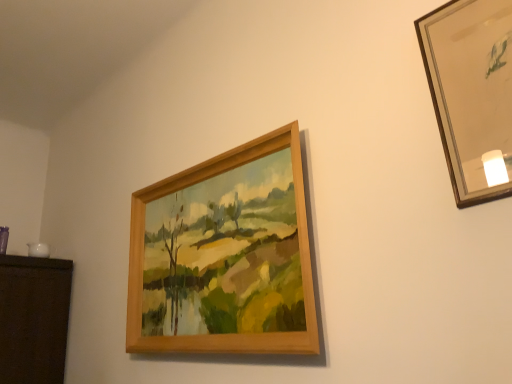
Question: From the image's perspective, is wooden picture frame at upper right, which ranks as the 2th picture frame in left-to-right order, beneath wooden frame at upper center, which is the first picture frame in back-to-front order?

Choices:
 (A) yes
 (B) no

Answer: (B)

Question: Is wooden picture frame at upper right, positioned as the 1th picture frame in front-to-back order, touching wooden frame at upper center, the first picture frame positioned from the left?

Choices:
 (A) yes
 (B) no

Answer: (B)

Question: Can you confirm if wooden picture frame at upper right, which appears as the first picture frame when viewed from the right, is positioned to the right of wooden frame at upper center, the first picture frame positioned from the left?

Choices:
 (A) no
 (B) yes

Answer: (B)

Question: Does wooden picture frame at upper right, which appears as the first picture frame when viewed from the right, have a lesser width compared to wooden frame at upper center, the second picture frame from the right?

Choices:
 (A) yes
 (B) no

Answer: (A)

Question: Can you confirm if wooden picture frame at upper right, positioned as the 1th picture frame in front-to-back order, is positioned to the left of wooden frame at upper center, the second picture frame from the right?

Choices:
 (A) no
 (B) yes

Answer: (A)

Question: Can you confirm if wooden picture frame at upper right, marked as the 2th picture frame in a back-to-front arrangement, is shorter than wooden frame at upper center, the first picture frame positioned from the left?

Choices:
 (A) yes
 (B) no

Answer: (A)

Question: Is wooden frame at upper center, the first picture frame positioned from the left, oriented away from wooden picture frame at upper right, marked as the 2th picture frame in a back-to-front arrangement?

Choices:
 (A) yes
 (B) no

Answer: (B)

Question: Considering the relative positions of wooden frame at upper center, which is the first picture frame in back-to-front order, and wooden picture frame at upper right, which appears as the first picture frame when viewed from the right, in the image provided, is wooden frame at upper center, which is the first picture frame in back-to-front order, to the left of wooden picture frame at upper right, which appears as the first picture frame when viewed from the right, from the viewer's perspective?

Choices:
 (A) yes
 (B) no

Answer: (A)

Question: Can you confirm if wooden frame at upper center, which is counted as the second picture frame, starting from the front, is positioned to the right of wooden picture frame at upper right, marked as the 2th picture frame in a back-to-front arrangement?

Choices:
 (A) no
 (B) yes

Answer: (A)

Question: From the image's perspective, is wooden frame at upper center, which is the first picture frame in back-to-front order, above wooden picture frame at upper right, marked as the 2th picture frame in a back-to-front arrangement?

Choices:
 (A) yes
 (B) no

Answer: (B)

Question: Is wooden frame at upper center, the first picture frame positioned from the left, outside wooden picture frame at upper right, which ranks as the 2th picture frame in left-to-right order?

Choices:
 (A) no
 (B) yes

Answer: (B)

Question: Is wooden frame at upper center, the first picture frame positioned from the left, thinner than wooden picture frame at upper right, which appears as the first picture frame when viewed from the right?

Choices:
 (A) no
 (B) yes

Answer: (A)

Question: In the image, is wooden frame at upper center, which is the first picture frame in back-to-front order, on the left side or the right side of wooden picture frame at upper right, which ranks as the 2th picture frame in left-to-right order?

Choices:
 (A) left
 (B) right

Answer: (A)